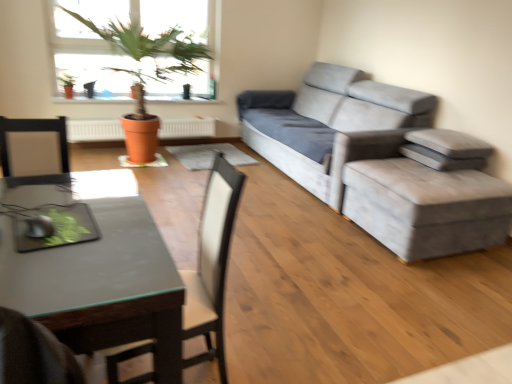
The image size is (512, 384). Find the location of `vacant area that lies between velvet grey stool at right and velvet grey couch at right`. vacant area that lies between velvet grey stool at right and velvet grey couch at right is located at coordinates (352, 230).